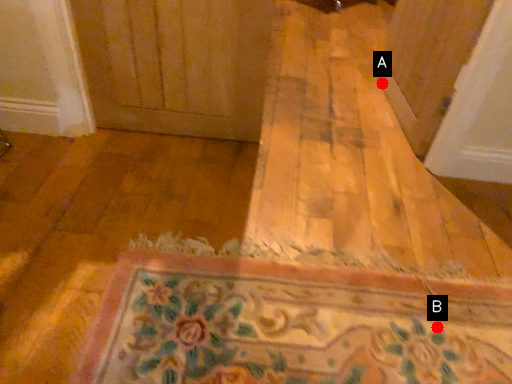
Question: Two points are circled on the image, labeled by A and B beside each circle. Which of the following is the farthest from the observer?

Choices:
 (A) A is further
 (B) B is further

Answer: (A)